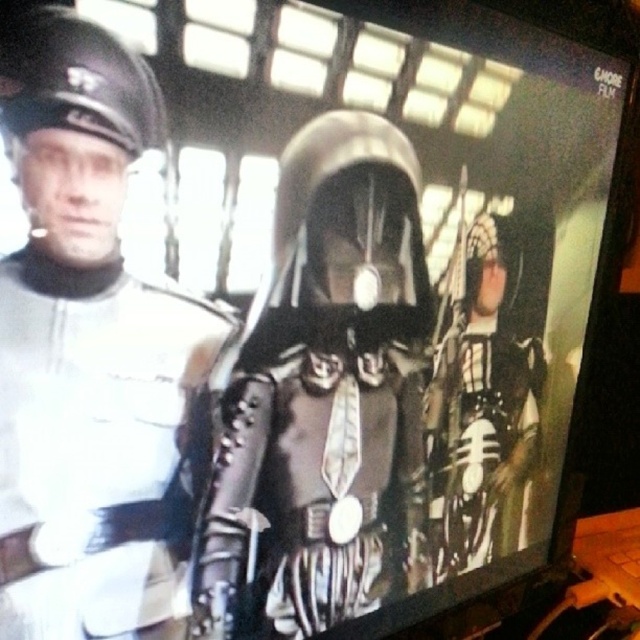
You are a character in the film scene shown on the screen. You need to choose between two armors to wear for a mission. The shiny silver armor at center and the black leather armor at center are both available. Based on their sizes, which one would be more suitable for a mission requiring stealth and agility?

The black leather armor at center is smaller and thus more suitable for missions requiring stealth and agility since it is less bulky than the shiny silver armor at center.

You are a character in the film scene shown on the screen. You need to retrieve the shiny silver armor at center. Which direction should you move from your current position at point 0.307, 0.509 relative to the screen?

The shiny silver armor at center is located at point (324, 392). Since your current position is at (324, 196), you should move to the right to reach it.

You are a character in the scene and need to choose between the shiny silver armor at center and the black leather armor at center. If you want to wear the wider armor, which one should you choose?

The shiny silver armor at center is wider than the black leather armor at center, so you should choose the shiny silver armor at center.